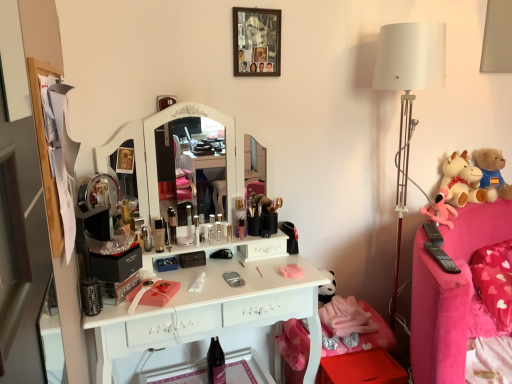
Question: From the image's perspective, is white plush cow at right, which appears as the 2th toy when viewed from the left, above or below pink fabric plush at right, marked as the 1th toy in a left-to-right arrangement?

Choices:
 (A) below
 (B) above

Answer: (B)

Question: Considering their positions, is white plush cow at right, the second toy viewed from the right, located in front of or behind pink fabric plush at right, the third toy in the right-to-left sequence?

Choices:
 (A) behind
 (B) front

Answer: (A)

Question: Which is nearer to the white fabric lampshade at right?

Choices:
 (A) metallic silver toiletry at center, which is the fourth toiletry in left-to-right order
 (B) satin gold makeup brush holder at center, the 1th toiletry when ordered from right to left
 (C) pink fabric plush at right, the third toy in the right-to-left sequence
 (D) metallic silver toiletry at center, which is the second toiletry in left-to-right order
 (E) translucent plastic container at center, which is the fifth toiletry in left-to-right order

Answer: (C)

Question: Considering the real-world distances, which object is closest to the white fabric lampshade at right?

Choices:
 (A) matte black lipstick at center, arranged as the third toiletry when viewed from the left
 (B) metallic silver toiletry at center, the sixth toiletry in the right-to-left sequence
 (C) metallic silver toiletry at center, positioned as the 5th toiletry in right-to-left order
 (D) translucent plastic container at center, the 2th toiletry in the right-to-left sequence
 (E) white plush cow at right, which appears as the 2th toy when viewed from the left

Answer: (E)